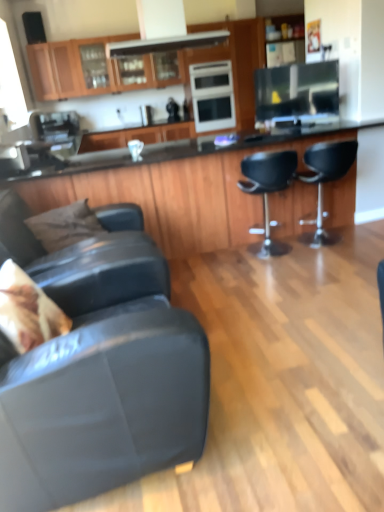
This screenshot has width=384, height=512. In order to click on black leather bar stool at center, which appears as the second chair when viewed from the right in this screenshot , I will do `click(268, 191)`.

I want to click on black leather bar stool at right, arranged as the 4th chair when viewed from the left, so click(325, 181).

Measure the distance between point (48, 337) and camera.

The depth of point (48, 337) is 1.69 meters.

Describe the element at coordinates (65, 225) in the screenshot. This screenshot has height=512, width=384. I see `brown fabric pillow at left, positioned as the 2th pillow in bottom-to-top order` at that location.

You are a GUI agent. You are given a task and a screenshot of the screen. Output one action in this format:
    pyautogui.click(x=<x>, y=<y>)
    Task: Click on the black leather bar stool at center, which appears as the second chair when viewed from the right
    
    Given the screenshot: What is the action you would take?
    pyautogui.click(x=268, y=191)

Considering the sizes of fluffy beige pillow at lower left, which is counted as the second pillow, starting from the top, and wooden cabinets at upper center in the image, is fluffy beige pillow at lower left, which is counted as the second pillow, starting from the top, taller or shorter than wooden cabinets at upper center?

Considering their sizes, fluffy beige pillow at lower left, which is counted as the second pillow, starting from the top, has less height than wooden cabinets at upper center.

Between fluffy beige pillow at lower left, which is the first pillow from bottom to top, and wooden cabinets at upper center, which one has larger width?

Wider between the two is wooden cabinets at upper center.

Can we say fluffy beige pillow at lower left, which is counted as the second pillow, starting from the top, lies outside wooden cabinets at upper center?

Yes.

From the image's perspective, which one is positioned higher, fluffy beige pillow at lower left, which is the first pillow from bottom to top, or wooden cabinets at upper center?

wooden cabinets at upper center appears higher in the image.

From the image's perspective, relative to matte black television at upper center, placed as the 2th appliance when sorted from top to bottom, is fluffy beige pillow at lower left, which is counted as the second pillow, starting from the top, above or below?

fluffy beige pillow at lower left, which is counted as the second pillow, starting from the top, is below matte black television at upper center, placed as the 2th appliance when sorted from top to bottom.

Which of these two, fluffy beige pillow at lower left, which is counted as the second pillow, starting from the top, or matte black television at upper center, the 2th appliance in the left-to-right sequence, is wider?

fluffy beige pillow at lower left, which is counted as the second pillow, starting from the top, is wider.

Between fluffy beige pillow at lower left, the 2th pillow when ordered from back to front, and matte black television at upper center, the 2th appliance in the left-to-right sequence, which one has more height?

Standing taller between the two is matte black television at upper center, the 2th appliance in the left-to-right sequence.

Consider the image. Does fluffy beige pillow at lower left, placed as the 1th pillow when sorted from front to back, turn towards matte black television at upper center, the first appliance when ordered from right to left?

No, fluffy beige pillow at lower left, placed as the 1th pillow when sorted from front to back, is not oriented towards matte black television at upper center, the first appliance when ordered from right to left.

From the image's perspective, is matte black television at upper center, positioned as the 2th appliance in back-to-front order, above sleek stainless steel oven at center, the 2th appliance from the bottom?

Incorrect, from the image's perspective, matte black television at upper center, positioned as the 2th appliance in back-to-front order, is lower than sleek stainless steel oven at center, the 2th appliance from the bottom.

Who is taller, matte black television at upper center, the 2th appliance in the left-to-right sequence, or sleek stainless steel oven at center, arranged as the 1th appliance when viewed from the back?

sleek stainless steel oven at center, arranged as the 1th appliance when viewed from the back.

Identify the location of appliance lying on the left of matte black television at upper center, the 1th appliance in the bottom-to-top sequence. (212, 96).

Is point (334, 98) farther from camera compared to point (209, 97)?

No.

From the picture: Which is nearer, (274, 247) or (330, 135)?

Point (330, 135)

From the image's perspective, relative to black glossy countertop at center, is black leather bar stool at center, which appears as the second chair when viewed from the right, above or below?

From the image's perspective, black leather bar stool at center, which appears as the second chair when viewed from the right, appears below black glossy countertop at center.

Can you see black leather bar stool at center, which appears as the second chair when viewed from the right, touching black glossy countertop at center?

No, black leather bar stool at center, which appears as the second chair when viewed from the right, is not next to black glossy countertop at center.

Can you confirm if black leather bar stool at center, marked as the 3th chair in a left-to-right arrangement, is bigger than black glossy countertop at center?

Incorrect, black leather bar stool at center, marked as the 3th chair in a left-to-right arrangement, is not larger than black glossy countertop at center.

Considering the positions of objects black leather bar stool at center, marked as the 3th chair in a left-to-right arrangement, and sleek stainless steel oven at center, the 1th appliance when ordered from left to right, in the image provided, who is behind, black leather bar stool at center, marked as the 3th chair in a left-to-right arrangement, or sleek stainless steel oven at center, the 1th appliance when ordered from left to right,?

sleek stainless steel oven at center, the 1th appliance when ordered from left to right, is further away from the camera.

Measure the distance between black leather bar stool at center, marked as the 3th chair in a left-to-right arrangement, and sleek stainless steel oven at center, arranged as the 1th appliance when viewed from the back.

black leather bar stool at center, marked as the 3th chair in a left-to-right arrangement, is 4.42 feet away from sleek stainless steel oven at center, arranged as the 1th appliance when viewed from the back.

Which object is thinner, black leather bar stool at center, which appears as the second chair when viewed from the right, or sleek stainless steel oven at center, arranged as the 1th appliance when viewed from the back?

black leather bar stool at center, which appears as the second chair when viewed from the right, is thinner.

Is black leather bar stool at center, which appears as the second chair when viewed from the right, to the left of sleek stainless steel oven at center, which is the 1th appliance from top to bottom, from the viewer's perspective?

In fact, black leather bar stool at center, which appears as the second chair when viewed from the right, is to the right of sleek stainless steel oven at center, which is the 1th appliance from top to bottom.

You are a GUI agent. You are given a task and a screenshot of the screen. Output one action in this format:
    pyautogui.click(x=<x>, y=<y>)
    Task: Click on the chair that is the 1st object located below the brown fabric pillow at left, positioned as the 2th pillow in bottom-to-top order (from the image's perspective)
    Image resolution: width=384 pixels, height=512 pixels.
    Given the screenshot: What is the action you would take?
    pyautogui.click(x=85, y=254)

Considering the positions of point (90, 257) and point (89, 226), is point (90, 257) closer or farther from the camera than point (89, 226)?

Point (90, 257) appears to be closer to the viewer than point (89, 226).

Is leather couch at lower left, positioned as the first chair in left-to-right order, behind brown fabric pillow at left, which is counted as the first pillow, starting from the back?

No, leather couch at lower left, positioned as the first chair in left-to-right order, is in front of brown fabric pillow at left, which is counted as the first pillow, starting from the back.

Locate an element on the screen. The width and height of the screenshot is (384, 512). chair in front of the fluffy beige pillow at lower left, placed as the 1th pillow when sorted from front to back is located at coordinates (102, 371).

Is matte black couch at lower left, acting as the third chair starting from the right, inside the boundaries of fluffy beige pillow at lower left, placed as the 1th pillow when sorted from front to back, or outside?

matte black couch at lower left, acting as the third chair starting from the right, exists outside the volume of fluffy beige pillow at lower left, placed as the 1th pillow when sorted from front to back.

Could you tell me if matte black couch at lower left, the second chair from the left, is facing fluffy beige pillow at lower left, the 2th pillow when ordered from back to front?

Yes, matte black couch at lower left, the second chair from the left, is turned towards fluffy beige pillow at lower left, the 2th pillow when ordered from back to front.

Which of these two, matte black couch at lower left, the second chair from the left, or fluffy beige pillow at lower left, which is counted as the second pillow, starting from the top, is thinner?

fluffy beige pillow at lower left, which is counted as the second pillow, starting from the top, is thinner.

You are a GUI agent. You are given a task and a screenshot of the screen. Output one action in this format:
    pyautogui.click(x=<x>, y=<y>)
    Task: Click on the cabinetry that is above the fluffy beige pillow at lower left, which is counted as the second pillow, starting from the top (from a real-world perspective)
    
    Given the screenshot: What is the action you would take?
    [97, 69]

From the image's perspective, which pillow is the 2nd one below the matte black television at upper center, the 1th appliance in the bottom-to-top sequence? Please provide its 2D coordinates.

[(27, 310)]

Which object lies further to the anchor point sleek stainless steel oven at center, which is the 1th appliance from top to bottom, fluffy beige pillow at lower left, which is the first pillow from bottom to top, or matte black television at upper center, the 1th appliance in the bottom-to-top sequence?

fluffy beige pillow at lower left, which is the first pillow from bottom to top, is further to sleek stainless steel oven at center, which is the 1th appliance from top to bottom.

Looking at this image, from the image, which object appears to be nearer to sleek stainless steel oven at center, which is the 1th appliance from top to bottom, matte black couch at lower left, the second chair from the left, or black glossy countertop at center?

Result: black glossy countertop at center is positioned closer to the anchor sleek stainless steel oven at center, which is the 1th appliance from top to bottom.

Estimate the real-world distances between objects in this image. Which object is closer to sleek stainless steel oven at center, the 1th appliance when ordered from left to right, leather couch at lower left, positioned as the first chair in left-to-right order, or matte black couch at lower left, the second chair from the left?

matte black couch at lower left, the second chair from the left, lies closer to sleek stainless steel oven at center, the 1th appliance when ordered from left to right, than the other object.

Which object lies nearer to the anchor point brown fabric pillow at left, which is counted as the first pillow, starting from the back, matte black couch at lower left, the second chair from the left, or fluffy beige pillow at lower left, which is counted as the second pillow, starting from the top?

matte black couch at lower left, the second chair from the left, is closer to brown fabric pillow at left, which is counted as the first pillow, starting from the back.

Estimate the real-world distances between objects in this image. Which object is further from wooden cabinets at upper center, sleek stainless steel oven at center, the 2th appliance in the right-to-left sequence, or matte black television at upper center, placed as the 2th appliance when sorted from top to bottom?

The object further to wooden cabinets at upper center is matte black television at upper center, placed as the 2th appliance when sorted from top to bottom.

Based on their spatial positions, is sleek stainless steel oven at center, the 2th appliance in the right-to-left sequence, or brown fabric pillow at left, positioned as the 2th pillow in bottom-to-top order, closer to matte black couch at lower left, acting as the third chair starting from the right?

The object closer to matte black couch at lower left, acting as the third chair starting from the right, is brown fabric pillow at left, positioned as the 2th pillow in bottom-to-top order.

Considering their positions, is leather couch at lower left, acting as the fourth chair starting from the right, positioned further to matte black couch at lower left, acting as the third chair starting from the right, than black leather bar stool at center, which appears as the second chair when viewed from the right?

Among the two, black leather bar stool at center, which appears as the second chair when viewed from the right, is located further to matte black couch at lower left, acting as the third chair starting from the right.

Considering their positions, is fluffy beige pillow at lower left, which is the first pillow from bottom to top, positioned closer to black glossy countertop at center than black leather bar stool at center, which appears as the second chair when viewed from the right?

Among the two, black leather bar stool at center, which appears as the second chair when viewed from the right, is located nearer to black glossy countertop at center.

Find the location of a particular element. chair between fluffy beige pillow at lower left, which is counted as the second pillow, starting from the top, and brown fabric pillow at left, positioned as the 2th pillow in bottom-to-top order, from front to back is located at coordinates (85, 254).

In order to click on countertop between brown fabric pillow at left, acting as the second pillow starting from the front, and matte black television at upper center, placed as the 2th appliance when sorted from top to bottom in this screenshot , I will do `click(178, 191)`.

Where is `cabinetry between matte black couch at lower left, the second chair from the left, and sleek stainless steel oven at center, which is the 1th appliance from top to bottom, along the z-axis`? The height and width of the screenshot is (512, 384). cabinetry between matte black couch at lower left, the second chair from the left, and sleek stainless steel oven at center, which is the 1th appliance from top to bottom, along the z-axis is located at coordinates (97, 69).

Locate an element on the screen. appliance between fluffy beige pillow at lower left, placed as the 1th pillow when sorted from front to back, and sleek stainless steel oven at center, the 1th appliance when ordered from left to right, in the front-back direction is located at coordinates (297, 93).